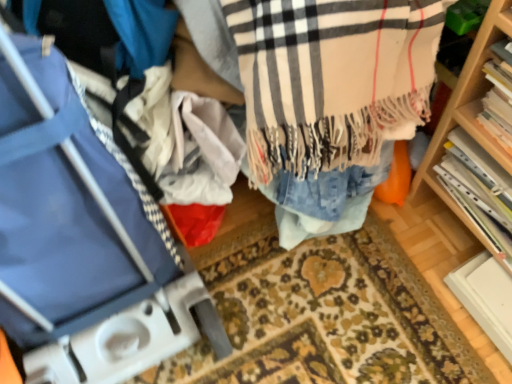
Find the location of a particular element. Image resolution: width=512 pixels, height=384 pixels. vacant space underneath hardcover book at right, the 1th book when ordered from back to front (from a real-world perspective) is located at coordinates (453, 228).